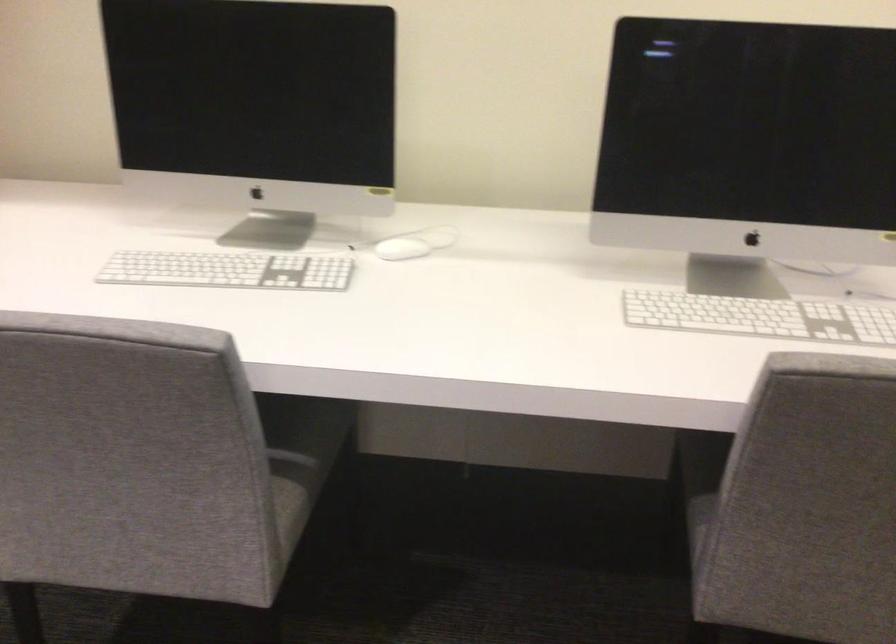
What are the coordinates of `chair sitting surface` in the screenshot? It's located at (291, 456).